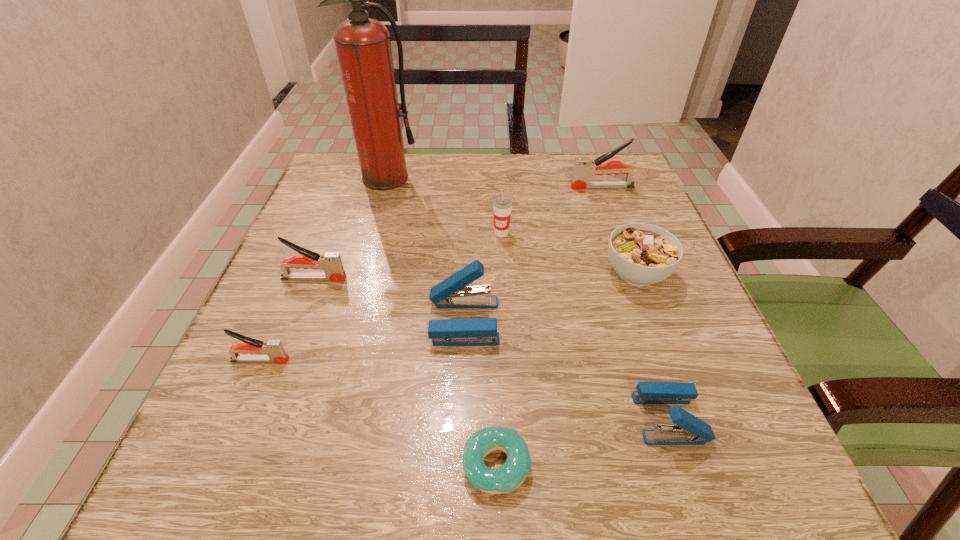
I want to click on the smallest gray stapler, so click(x=274, y=349).

The image size is (960, 540). In order to click on the nearest gray stapler in this screenshot , I will do `click(274, 349)`.

The image size is (960, 540). In order to click on soup bowl in this screenshot , I will do `click(642, 254)`.

I want to click on the nearer blue stapler, so pos(689,430).

Find the location of a particular element. The width and height of the screenshot is (960, 540). the nearest stapler is located at coordinates (689, 430).

Locate an element on the screen. The width and height of the screenshot is (960, 540). the shortest object is located at coordinates (508, 477).

The height and width of the screenshot is (540, 960). Identify the location of blank space located 0.050m at the nozzle of the fire extinguisher. coord(379,202).

The width and height of the screenshot is (960, 540). I want to click on vacant point located 0.280m on the handle side of the biggest gray stapler, so click(455, 187).

Where is `free location located 0.190m on the handle side of the biggest gray stapler`? free location located 0.190m on the handle side of the biggest gray stapler is located at coordinates (492, 187).

Locate an element on the screen. The height and width of the screenshot is (540, 960). vacant space located 0.330m on the handle side of the biggest gray stapler is located at coordinates (434, 187).